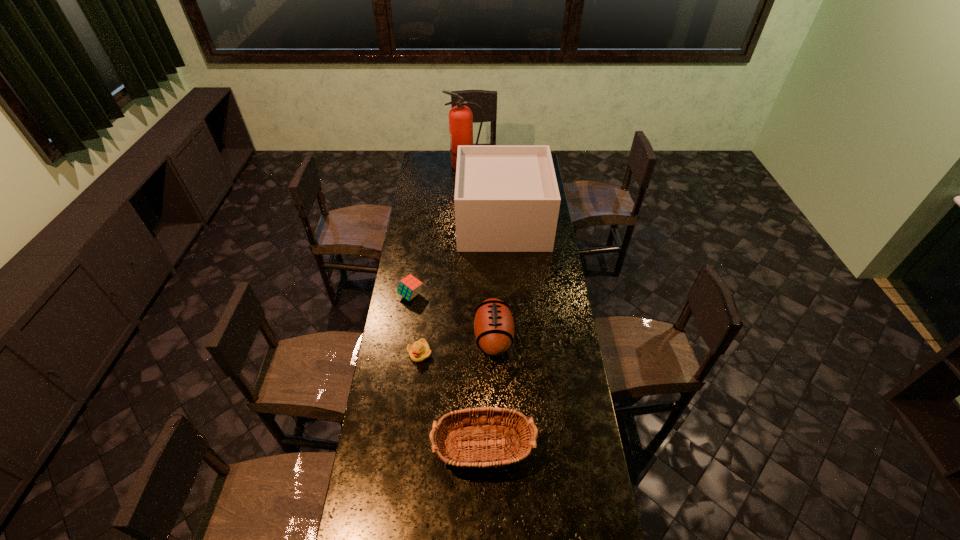
The height and width of the screenshot is (540, 960). I want to click on object at the right edge, so click(x=507, y=199).

Locate an element on the screen. Image resolution: width=960 pixels, height=540 pixels. free spot at the left edge of the desktop is located at coordinates (378, 430).

Image resolution: width=960 pixels, height=540 pixels. Identify the location of vacant space at the right edge. (569, 502).

Identify the location of free space at the far left corner of the desktop. (423, 167).

At what (x,y) coordinates should I click in order to perform the action: click on free space between the football (American) and the second shortest object. Please return your answer as a coordinate pair (x, y). Image resolution: width=960 pixels, height=540 pixels. Looking at the image, I should click on (452, 316).

Identify the location of free space between the nearest object and the fire extinguisher. (473, 307).

The image size is (960, 540). Find the location of `empty space that is in between the fourth nearest object and the nearest object`. empty space that is in between the fourth nearest object and the nearest object is located at coordinates (446, 372).

Identify the location of vacant space that is in between the third farthest object and the fire extinguisher. (438, 231).

You are a GUI agent. You are given a task and a screenshot of the screen. Output one action in this format:
    pyautogui.click(x=<x>, y=<y>)
    Task: Click on the vacant region between the shortest object and the fifth tallest object
    
    Given the screenshot: What is the action you would take?
    pyautogui.click(x=416, y=324)

Choose which object is the fourth nearest neighbor to the nearest object. Please provide its 2D coordinates. Your answer should be formatted as a tuple, i.e. [(x, y)], where the tuple contains the x and y coordinates of a point satisfying the conditions above.

[(507, 199)]